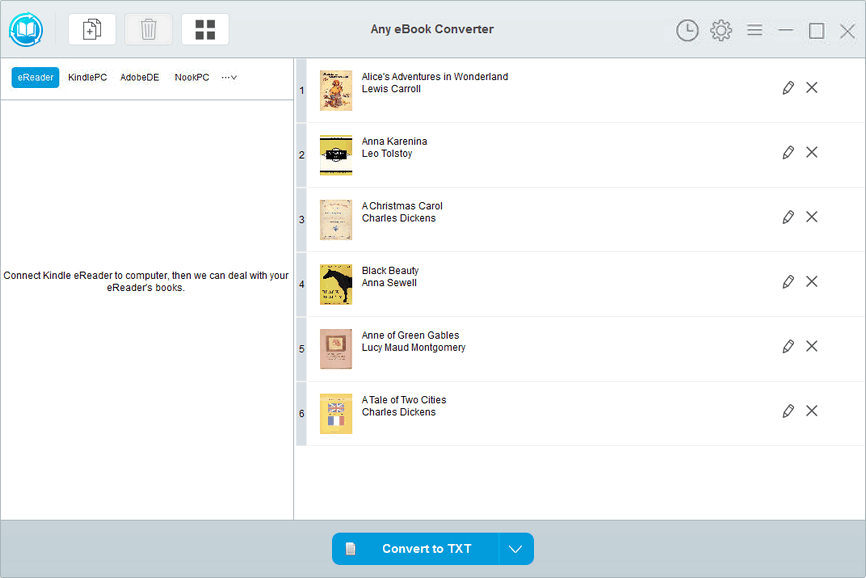
Find the location of a particular element. The width and height of the screenshot is (866, 578). ebook is located at coordinates (337, 217).